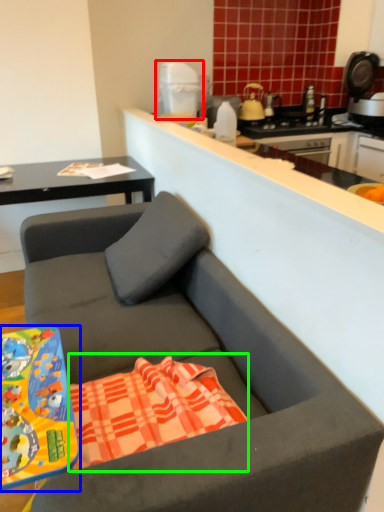
Question: Which object is the farthest from appliance (highlighted by a red box)? Choose among these: desk (highlighted by a blue box) or beach towel (highlighted by a green box).

Choices:
 (A) desk
 (B) beach towel

Answer: (A)